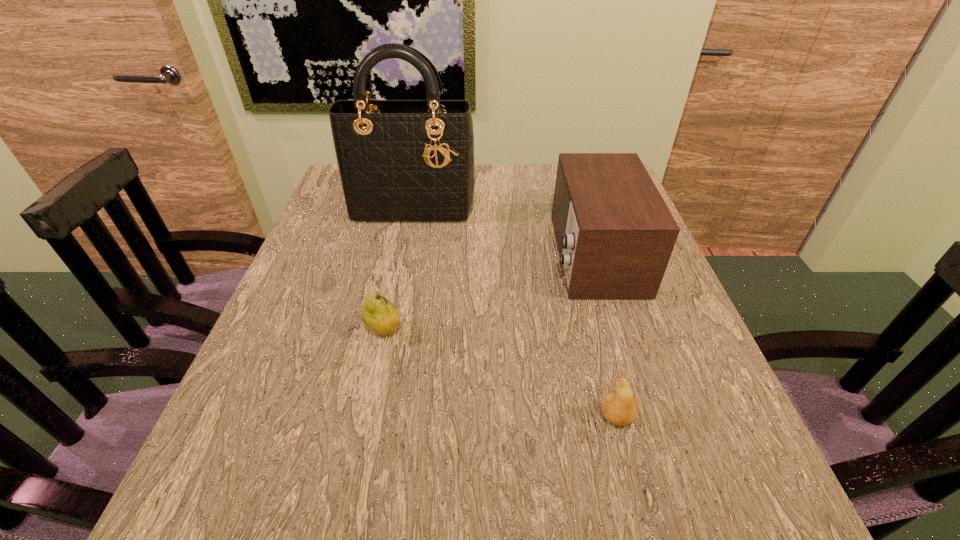
This screenshot has height=540, width=960. I want to click on vacant space in between the second tallest object and the second nearest object, so click(x=489, y=292).

Find the location of a particular element. free space between the handbag and the farther pear is located at coordinates (398, 269).

At what (x,y) coordinates should I click in order to perform the action: click on vacant area that lies between the right pear and the left pear. Please return your answer as a coordinate pair (x, y). This screenshot has width=960, height=540. Looking at the image, I should click on (500, 374).

Find the location of a particular element. This screenshot has height=540, width=960. free spot between the left pear and the second tallest object is located at coordinates (489, 292).

This screenshot has height=540, width=960. Find the location of `empty space that is in between the nearest object and the tallest object`. empty space that is in between the nearest object and the tallest object is located at coordinates point(515,313).

You are a GUI agent. You are given a task and a screenshot of the screen. Output one action in this format:
    pyautogui.click(x=<x>, y=<y>)
    Task: Click on the free spot between the tallest object and the second tallest object
    
    Given the screenshot: What is the action you would take?
    pyautogui.click(x=503, y=231)

This screenshot has height=540, width=960. What are the coordinates of `free space between the tallest object and the radio receiver` in the screenshot? It's located at (503, 231).

Locate an element on the screen. vacant area that lies between the farther pear and the radio receiver is located at coordinates (489, 292).

Locate an element on the screen. The height and width of the screenshot is (540, 960). vacant region between the tallest object and the third farthest object is located at coordinates (398, 269).

At what (x,y) coordinates should I click in order to perform the action: click on object identified as the second closest to the handbag. Please return your answer as a coordinate pair (x, y). Image resolution: width=960 pixels, height=540 pixels. Looking at the image, I should click on (379, 314).